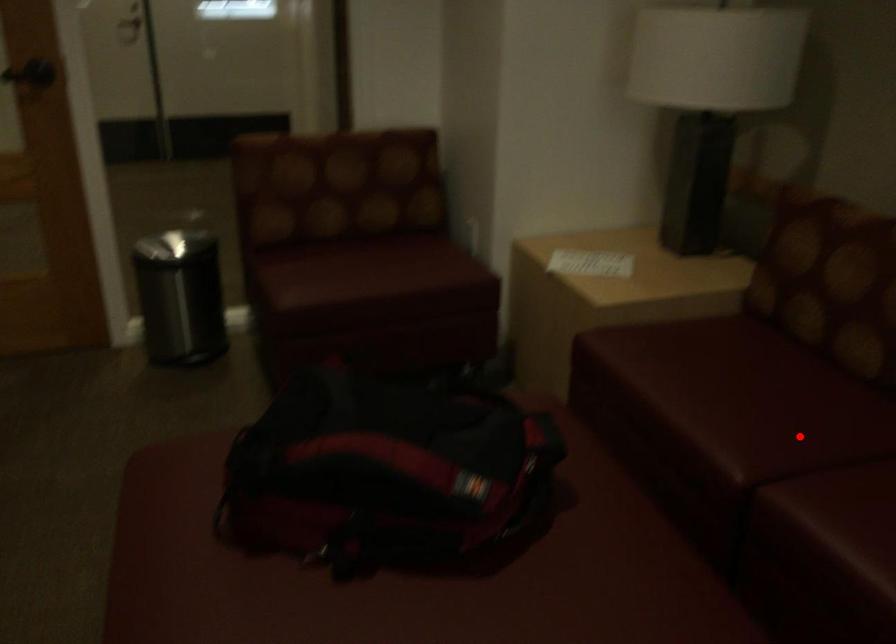
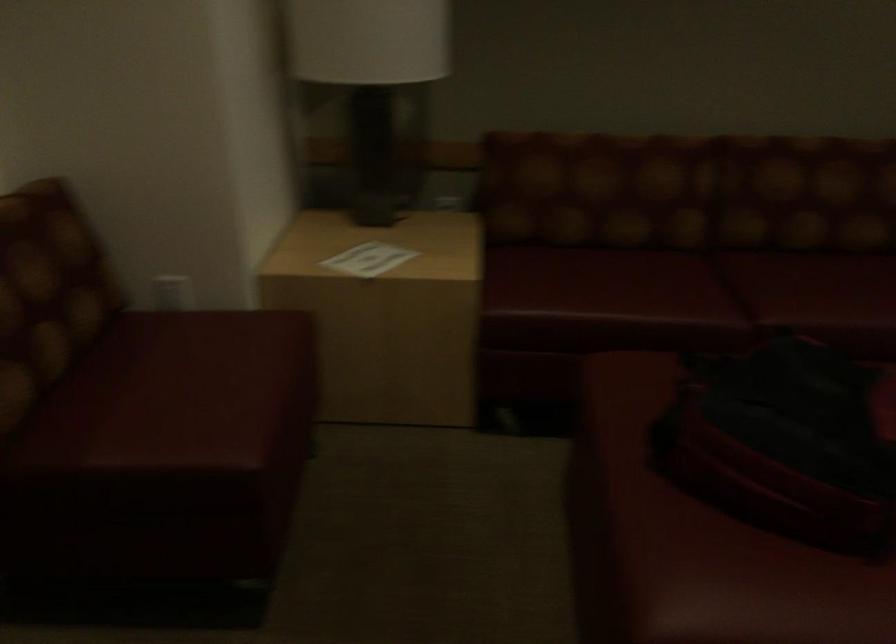
In the second image, find the point that corresponds to the highlighted location in the first image.

(698, 286)